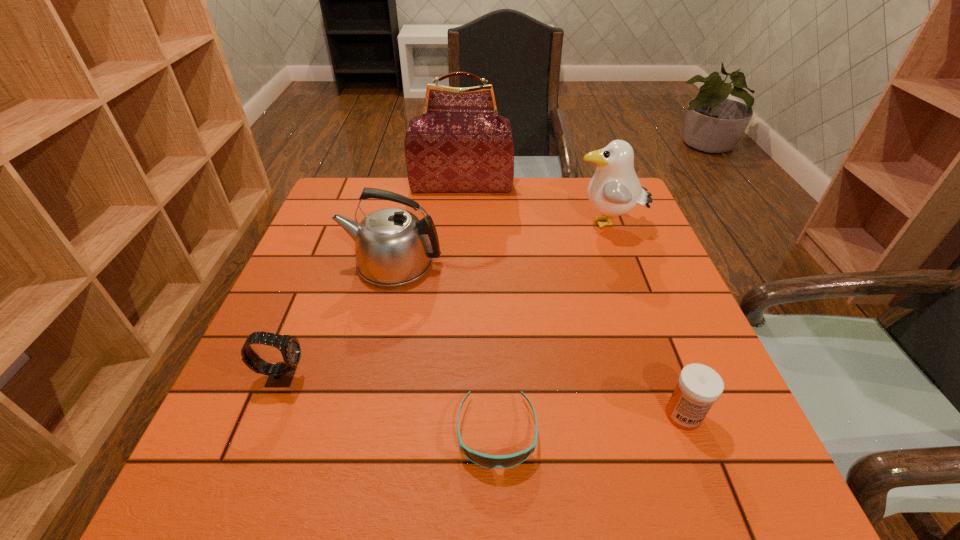
I want to click on the farthest object, so click(460, 143).

What are the coordinates of `the tallest object` in the screenshot? It's located at (460, 143).

Locate an element on the screen. gull is located at coordinates (614, 190).

What are the coordinates of `kettle` in the screenshot? It's located at (393, 247).

I want to click on the third nearest object, so click(281, 374).

Identify the location of medicine. This screenshot has width=960, height=540. (699, 386).

In order to click on the shortest object in this screenshot , I will do `click(487, 461)`.

Identify the location of vacant space located 0.290m on the front-facing side of the tallest object. The width and height of the screenshot is (960, 540). (458, 254).

This screenshot has height=540, width=960. I want to click on vacant space situated on the beak of the gull, so click(493, 225).

This screenshot has width=960, height=540. Identify the location of vacant space located 0.080m on the beak of the gull. (543, 225).